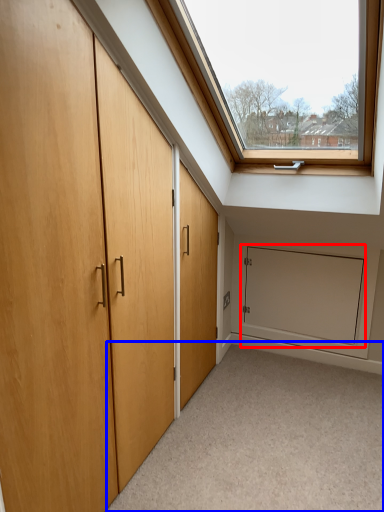
Question: Which object appears closest to the camera in this image, screen door (highlighted by a red box) or corridor (highlighted by a blue box)?

Choices:
 (A) screen door
 (B) corridor

Answer: (B)